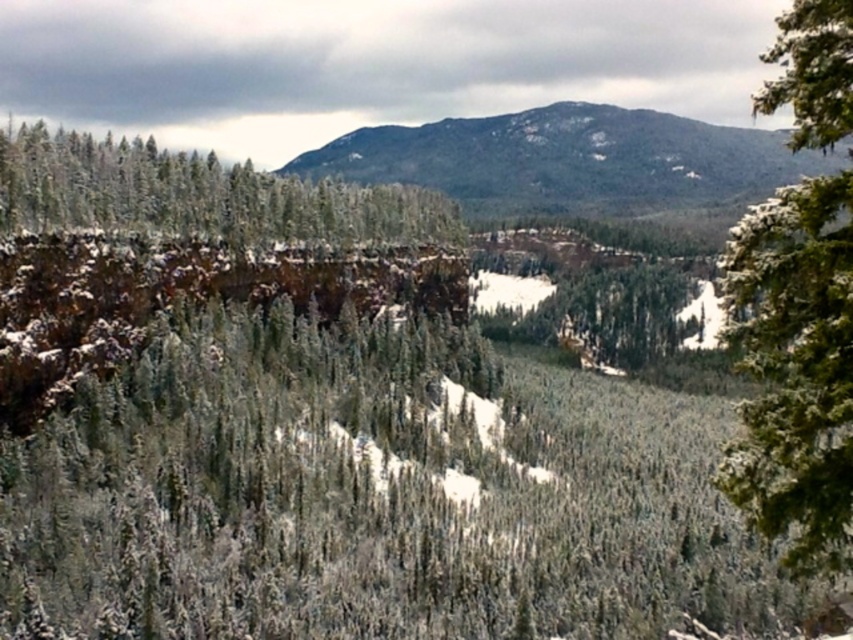
Question: Which object is the closest to the green textured pine tree at right?

Choices:
 (A) green matte evergreen tree at left
 (B) sandy brown rock at center

Answer: (A)

Question: Which object is positioned farthest from the sandy brown rock at center?

Choices:
 (A) green textured pine tree at right
 (B) green matte evergreen tree at left

Answer: (A)

Question: Can you confirm if sandy brown rock at center is positioned below green matte evergreen tree at left?

Choices:
 (A) no
 (B) yes

Answer: (A)

Question: Can you confirm if green textured pine tree at right is positioned to the left of green matte evergreen tree at left?

Choices:
 (A) yes
 (B) no

Answer: (B)

Question: Which object appears closest to the camera in this image?

Choices:
 (A) green textured pine tree at right
 (B) green matte evergreen tree at left
 (C) sandy brown rock at center

Answer: (A)

Question: Can you confirm if sandy brown rock at center is wider than green matte evergreen tree at left?

Choices:
 (A) no
 (B) yes

Answer: (B)